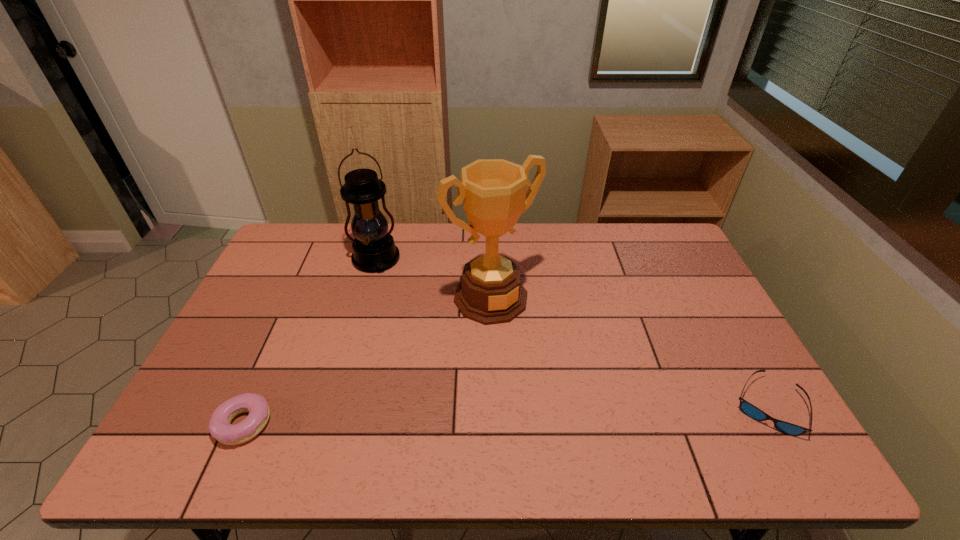
Where is `vacant spot on the desktop that is between the leftmost object and the rightmost object and is positioned above the third object from right to left, indicating its light source`? vacant spot on the desktop that is between the leftmost object and the rightmost object and is positioned above the third object from right to left, indicating its light source is located at coordinates (435, 417).

This screenshot has width=960, height=540. What are the coordinates of `vacant spot on the desktop that is between the leftmost object and the sunglasses and is positioned on the front-facing side of the award` in the screenshot? It's located at (578, 413).